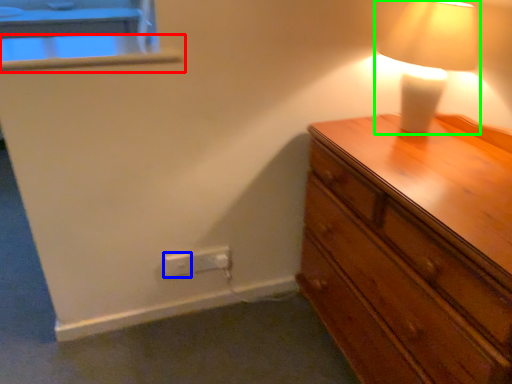
Question: Which object is the closest to the window sill (highlighted by a red box)? Choose among these: electric outlet (highlighted by a blue box) or lamp (highlighted by a green box).

Choices:
 (A) electric outlet
 (B) lamp

Answer: (A)